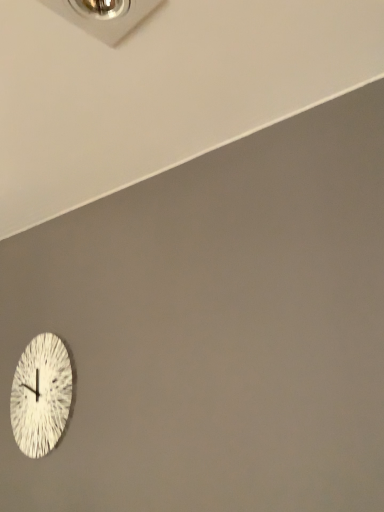
Measure the distance between point (42, 362) and camera.

They are 5.52 feet apart.

Locate an element on the screen. white textured clock at lower left is located at coordinates (41, 395).

Describe the element at coordinates (41, 395) in the screenshot. I see `white textured clock at lower left` at that location.

Image resolution: width=384 pixels, height=512 pixels. Describe the element at coordinates (104, 16) in the screenshot. I see `metallic silver outlet at upper center` at that location.

The height and width of the screenshot is (512, 384). Identify the location of metallic silver outlet at upper center. (104, 16).

Where is `white textured clock at lower left`? The image size is (384, 512). white textured clock at lower left is located at coordinates (41, 395).

Between metallic silver outlet at upper center and white textured clock at lower left, which one appears on the right side from the viewer's perspective?

Positioned to the right is metallic silver outlet at upper center.

Is the position of metallic silver outlet at upper center less distant than that of white textured clock at lower left?

Yes, metallic silver outlet at upper center is closer to the camera.

Considering the points (136, 24) and (57, 338), which point is behind, point (136, 24) or point (57, 338)?

The point (57, 338) is behind.

From the image's perspective, which one is positioned higher, metallic silver outlet at upper center or white textured clock at lower left?

metallic silver outlet at upper center.

From a real-world perspective, which object stands above the other?

In real-world perspective, metallic silver outlet at upper center is above.

Between metallic silver outlet at upper center and white textured clock at lower left, which one has smaller width?

white textured clock at lower left is thinner.

Between metallic silver outlet at upper center and white textured clock at lower left, which one has more height?

white textured clock at lower left.

From the picture: In terms of size, does metallic silver outlet at upper center appear bigger or smaller than white textured clock at lower left?

Clearly, metallic silver outlet at upper center is smaller in size than white textured clock at lower left.

Choose the correct answer: Is metallic silver outlet at upper center inside white textured clock at lower left or outside it?

metallic silver outlet at upper center exists outside the volume of white textured clock at lower left.

Would you say metallic silver outlet at upper center is a long distance from white textured clock at lower left?

metallic silver outlet at upper center is far away from white textured clock at lower left.

Is white textured clock at lower left at the back of metallic silver outlet at upper center?

No, metallic silver outlet at upper center is not facing away from white textured clock at lower left.

How different are the orientations of metallic silver outlet at upper center and white textured clock at lower left in degrees?

metallic silver outlet at upper center and white textured clock at lower left are facing 3.25 degrees away from each other.

Based on the photo, measure the distance from metallic silver outlet at upper center to white textured clock at lower left.

1.26 meters.

You are a GUI agent. You are given a task and a screenshot of the screen. Output one action in this format:
    pyautogui.click(x=<x>, y=<y>)
    Task: Click on the electric outlet on the right of the white textured clock at lower left
    The image size is (384, 512).
    Given the screenshot: What is the action you would take?
    pyautogui.click(x=104, y=16)

In the scene shown: Is white textured clock at lower left to the right of metallic silver outlet at upper center from the viewer's perspective?

No, white textured clock at lower left is not to the right of metallic silver outlet at upper center.

Considering the relative positions of white textured clock at lower left and metallic silver outlet at upper center in the image provided, is white textured clock at lower left in front of metallic silver outlet at upper center?

No, the depth of white textured clock at lower left is greater than that of metallic silver outlet at upper center.

Is point (45, 370) closer to camera compared to point (144, 12)?

No.

From the image's perspective, is white textured clock at lower left below metallic silver outlet at upper center?

Correct, white textured clock at lower left appears lower than metallic silver outlet at upper center in the image.

From a real-world perspective, is white textured clock at lower left located higher than metallic silver outlet at upper center?

No.

Considering the sizes of white textured clock at lower left and metallic silver outlet at upper center in the image, is white textured clock at lower left wider or thinner than metallic silver outlet at upper center?

In the image, white textured clock at lower left appears to be more narrow than metallic silver outlet at upper center.

Considering the sizes of objects white textured clock at lower left and metallic silver outlet at upper center in the image provided, who is taller, white textured clock at lower left or metallic silver outlet at upper center?

With more height is white textured clock at lower left.

Can you confirm if white textured clock at lower left is smaller than metallic silver outlet at upper center?

No, white textured clock at lower left is not smaller than metallic silver outlet at upper center.

Choose the correct answer: Is white textured clock at lower left inside metallic silver outlet at upper center or outside it?

white textured clock at lower left is spatially situated outside metallic silver outlet at upper center.

Is white textured clock at lower left placed right next to metallic silver outlet at upper center?

There is a gap between white textured clock at lower left and metallic silver outlet at upper center.

Could you tell me if white textured clock at lower left is turned towards metallic silver outlet at upper center?

No, white textured clock at lower left is not oriented towards metallic silver outlet at upper center.

This screenshot has height=512, width=384. In order to click on wall clock to the left of metallic silver outlet at upper center in this screenshot , I will do `click(41, 395)`.

Find the location of a particular element. wall clock beneath the metallic silver outlet at upper center (from a real-world perspective) is located at coordinates (41, 395).

Find the location of a particular element. This screenshot has height=512, width=384. electric outlet above the white textured clock at lower left (from the image's perspective) is located at coordinates (104, 16).